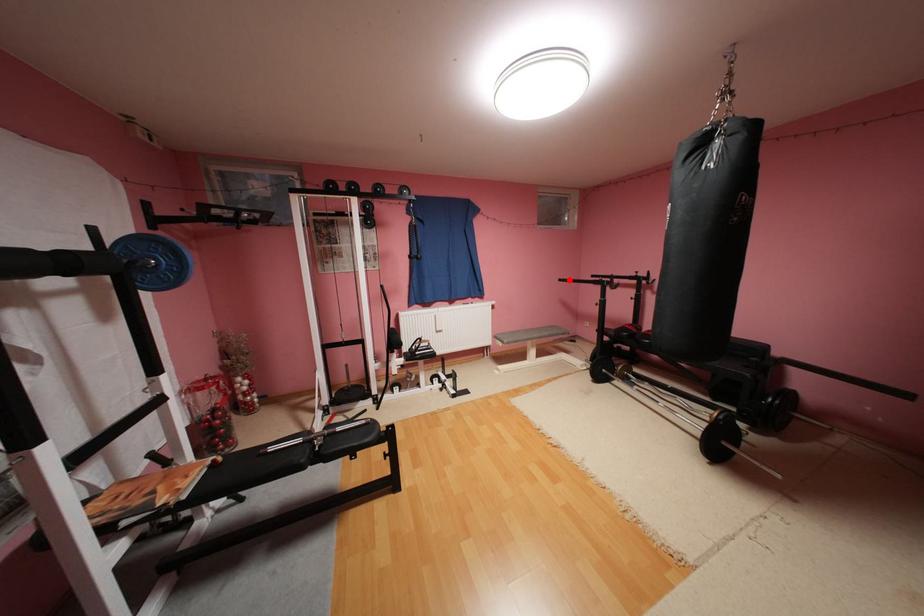
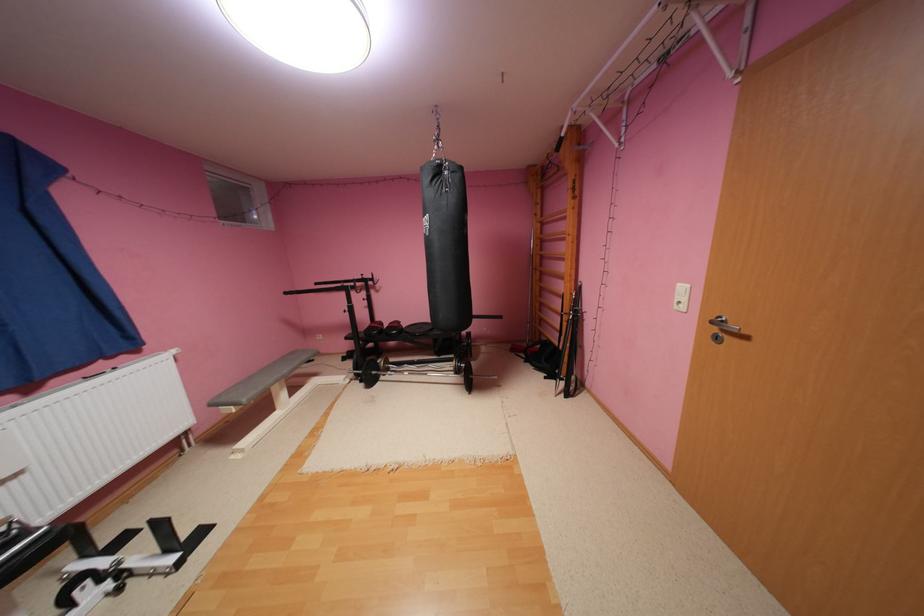
Question: I am providing you with two images of the same scene from different viewpoints. Given a red point in image1, look at the same physical point in image2. Is it:

Choices:
 (A) Closer to the viewpoint
 (B) Farther from the viewpoint

Answer: (A)